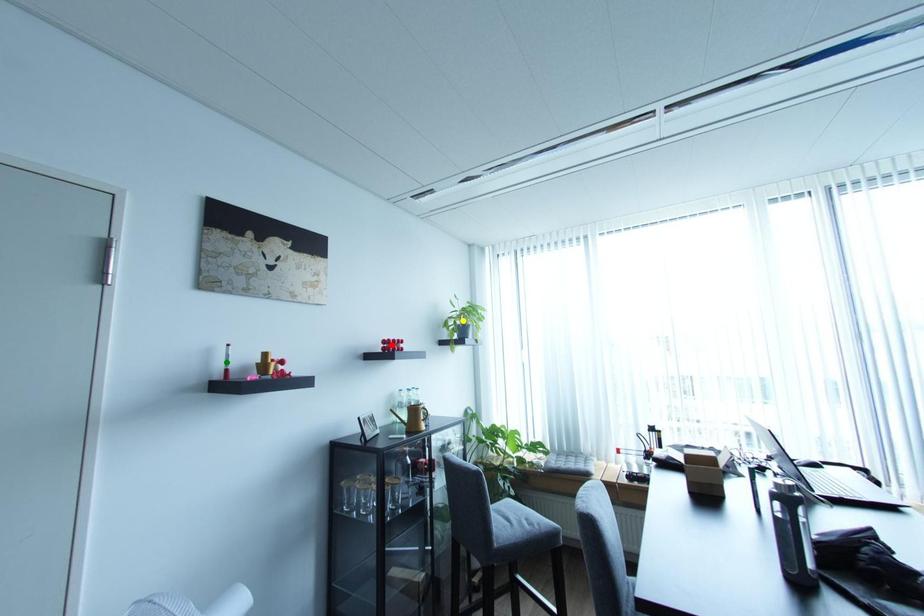
Order these from farthest to nearest:
A) yellow point
B) red point
C) green point

yellow point, red point, green point